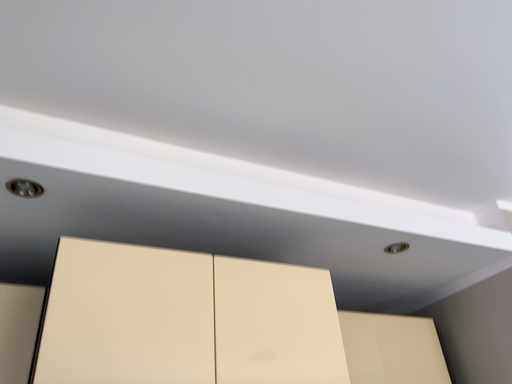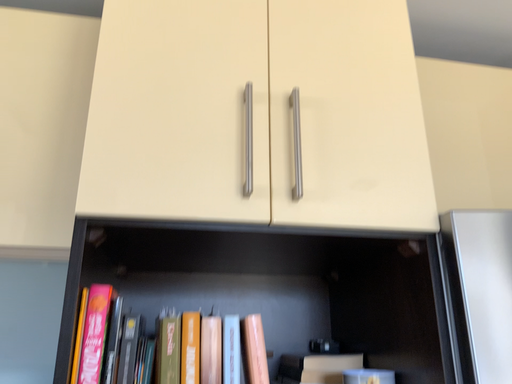
Question: How did the camera likely rotate when shooting the video?

Choices:
 (A) rotated upward
 (B) rotated downward

Answer: (B)